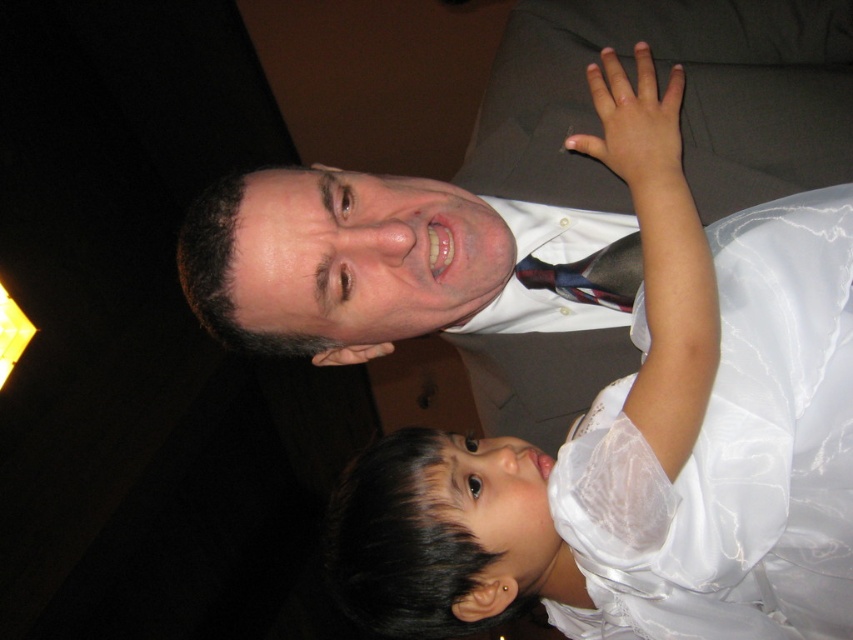
Based on the coordinates provided in the scene, where is the white satin dress at upper right positioned?

The white satin dress at upper right is positioned at point (730, 456).